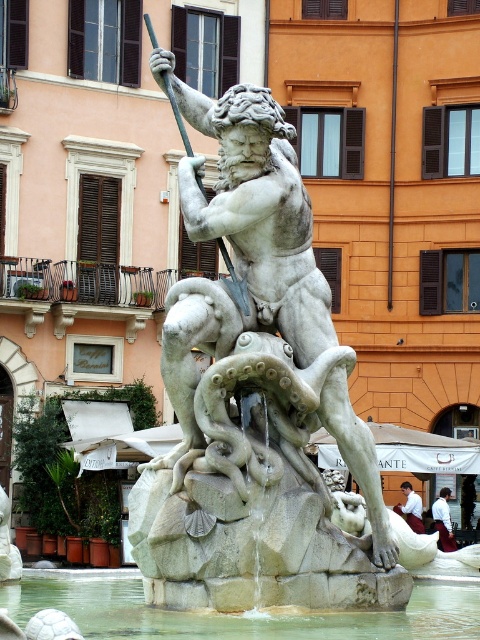
Question: Which point is closer to the camera?

Choices:
 (A) (339, 632)
 (B) (410, 488)
 (C) (443, 502)

Answer: (A)

Question: Is clear stone water at center bigger than white cotton shirt at center?

Choices:
 (A) no
 (B) yes

Answer: (B)

Question: Is clear stone water at center above white shirt at center?

Choices:
 (A) no
 (B) yes

Answer: (B)

Question: From the image, what is the correct spatial relationship of white marble statue at center in relation to clear stone water at center?

Choices:
 (A) above
 (B) below

Answer: (A)

Question: Which object appears closest to the camera in this image?

Choices:
 (A) clear stone water at center
 (B) white shirt at center
 (C) white cotton shirt at center
 (D) white marble statue at center

Answer: (A)

Question: Estimate the real-world distances between objects in this image. Which object is farther from the white marble statue at center?

Choices:
 (A) clear stone water at center
 (B) white cotton shirt at center
 (C) white shirt at center

Answer: (B)